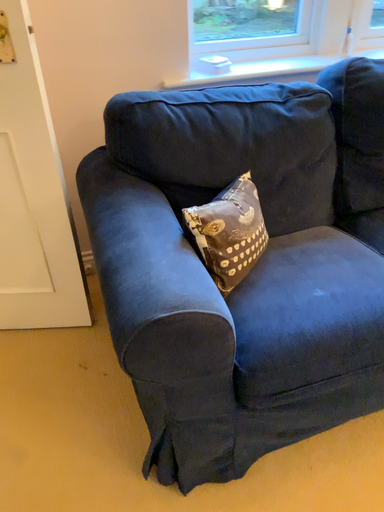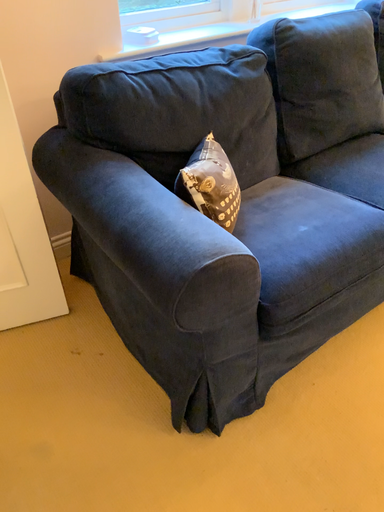
Question: Which way did the camera rotate in the video?

Choices:
 (A) rotated left
 (B) rotated right

Answer: (B)